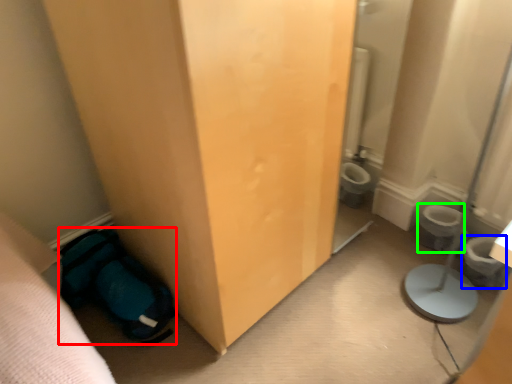
Question: Which is farther away from sleeping bag (highlighted by a red box)? potty (highlighted by a blue box) or toilet bowl (highlighted by a green box)?

Choices:
 (A) potty
 (B) toilet bowl

Answer: (A)